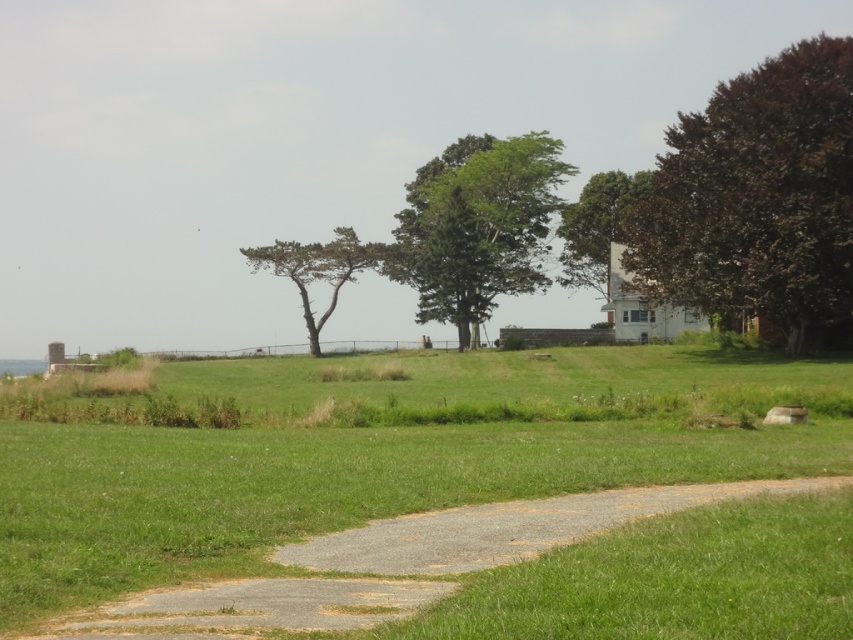
Question: Which object appears farthest from the camera in this image?

Choices:
 (A) green leafy tree at center
 (B) green leafy tree at upper center
 (C) green textured tree at center
 (D) dark brown textured tree at upper right

Answer: (C)

Question: Which point is farther from the camera taking this photo?

Choices:
 (A) (334, 292)
 (B) (611, 221)

Answer: (A)

Question: Can you confirm if green leafy tree at center is positioned above green textured tree at center?

Choices:
 (A) yes
 (B) no

Answer: (A)

Question: Does green leafy tree at center appear under green textured tree at center?

Choices:
 (A) yes
 (B) no

Answer: (B)

Question: Can you confirm if green leafy tree at upper center is wider than green textured tree at center?

Choices:
 (A) no
 (B) yes

Answer: (B)

Question: Which of these objects is positioned farthest from the green leafy tree at center?

Choices:
 (A) green leafy tree at upper center
 (B) green grass at center
 (C) green textured tree at center

Answer: (B)